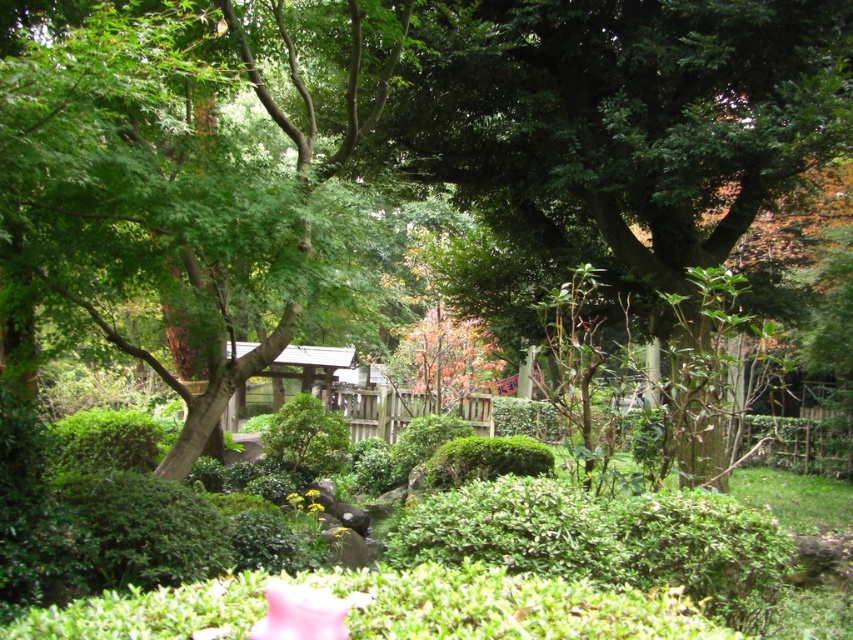
Who is shorter, green leafy bush at center or green leafy hedge at center?

Standing shorter between the two is green leafy hedge at center.

Based on the photo, is green leafy bush at center further to camera compared to green leafy hedge at center?

Yes, green leafy bush at center is behind green leafy hedge at center.

This screenshot has height=640, width=853. What are the coordinates of `green leafy bush at center` in the screenshot? It's located at (305, 438).

Between green leafy tree at center and green leafy hedge at center, which one is positioned lower?

green leafy hedge at center

Between green leafy tree at center and green leafy hedge at center, which one has less height?

With less height is green leafy tree at center.

This screenshot has width=853, height=640. Identify the location of green leafy tree at center. (180, 164).

Does green leafy tree at center have a lesser height compared to green leafy bush at center?

Yes, green leafy tree at center is shorter than green leafy bush at center.

Does green leafy tree at center appear on the right side of green leafy bush at center?

In fact, green leafy tree at center is to the left of green leafy bush at center.

This screenshot has height=640, width=853. I want to click on green leafy tree at center, so click(180, 164).